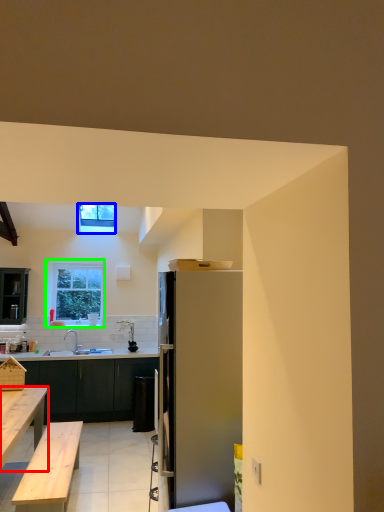
Question: Which object is the farthest from desk (highlighted by a red box)? Choose among these: window (highlighted by a blue box) or window (highlighted by a green box).

Choices:
 (A) window
 (B) window

Answer: (A)